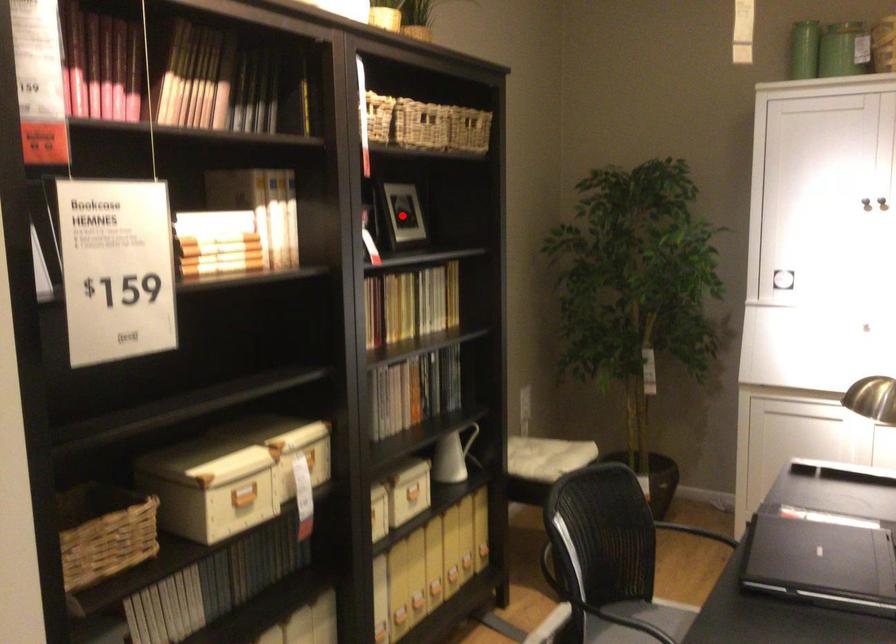
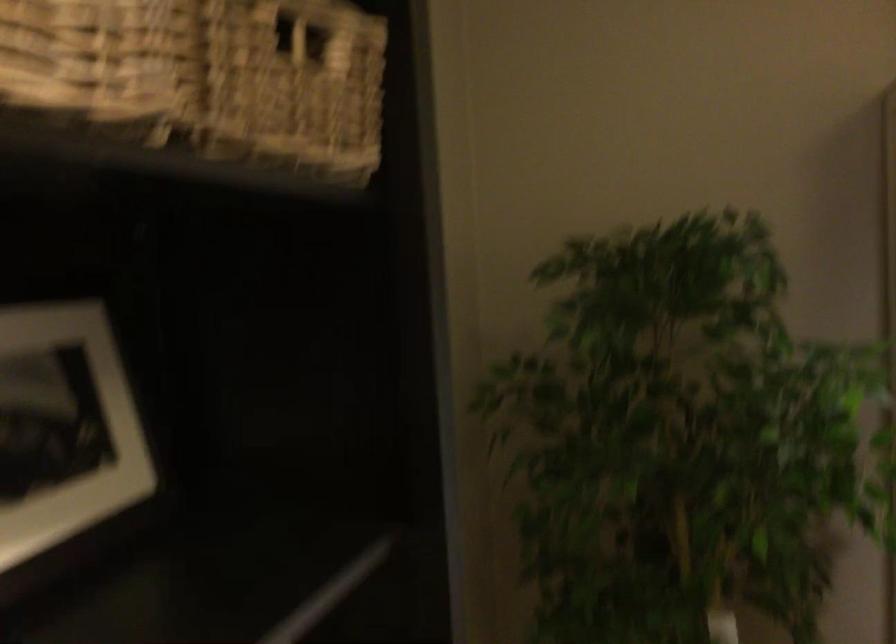
Question: I am providing you with two images of the same scene from different viewpoints. Image1 has a red point marked. In image2, the corresponding 3D location appears at what relative position? Reply with the corresponding letter.

Choices:
 (A) Closer
 (B) Farther

Answer: (A)